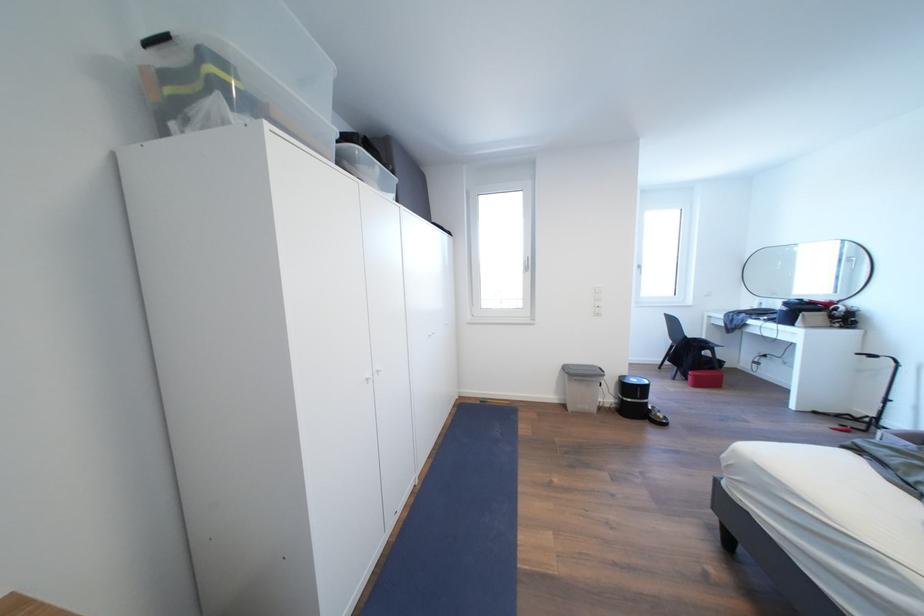
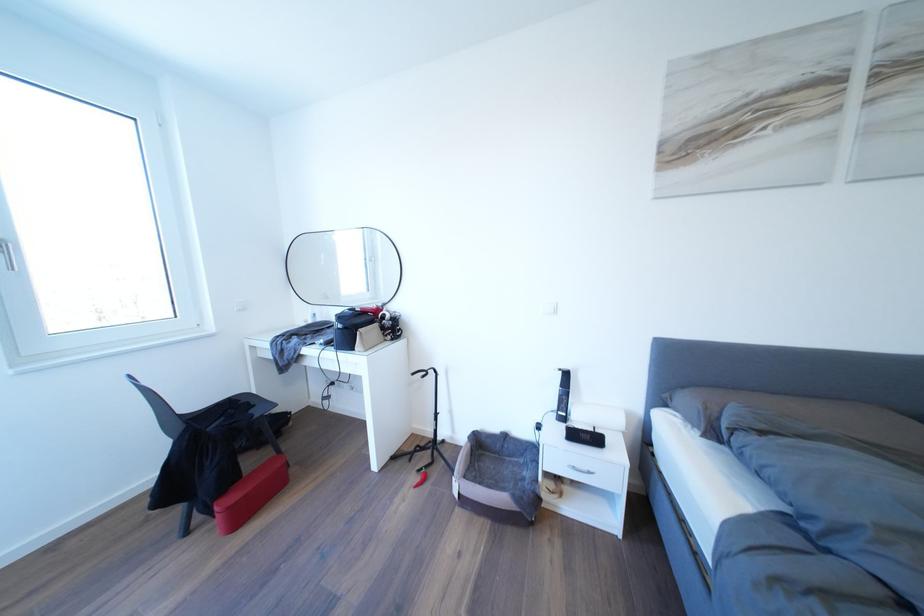
In the second image, find the point that corresponds to point (757, 309) in the first image.

(310, 322)